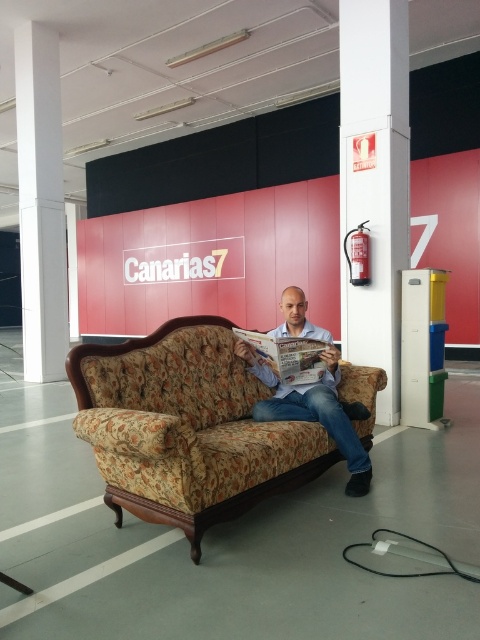
You are standing in the middle of the room and want to reach the white glossy fire extinguisher at right. Which direction should you move to avoid the white smooth pillar at left?

To reach the white glossy fire extinguisher at right while avoiding the white smooth pillar at left, move towards the right side of the room. Since the fire extinguisher is in front of the pillar, moving right will allow you to bypass the pillar and access the extinguisher directly.

You are a photographer setting up a shoot in the described room. You have a floral fabric couch at center and a matte blue shirt at center. Which object should you focus on first if you want to capture the larger item in your frame?

The floral fabric couch at center has a larger size compared to the matte blue shirt at center, so you should focus on the floral fabric couch at center first to capture the larger item in your frame.